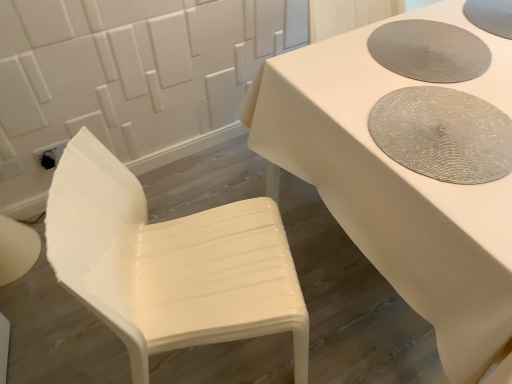
The height and width of the screenshot is (384, 512). I want to click on free spot below textured gray placemat at upper right, the second manhole cover positioned from the bottom (from a real-world perspective), so coord(420,50).